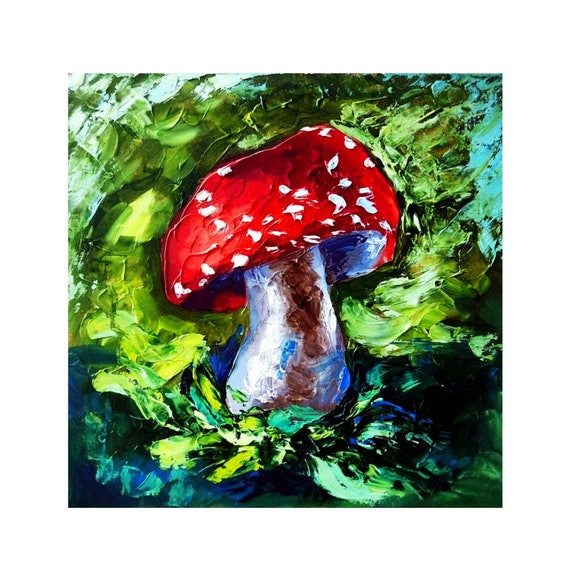
Identify the location of upper right corner of artwork. (498, 75).